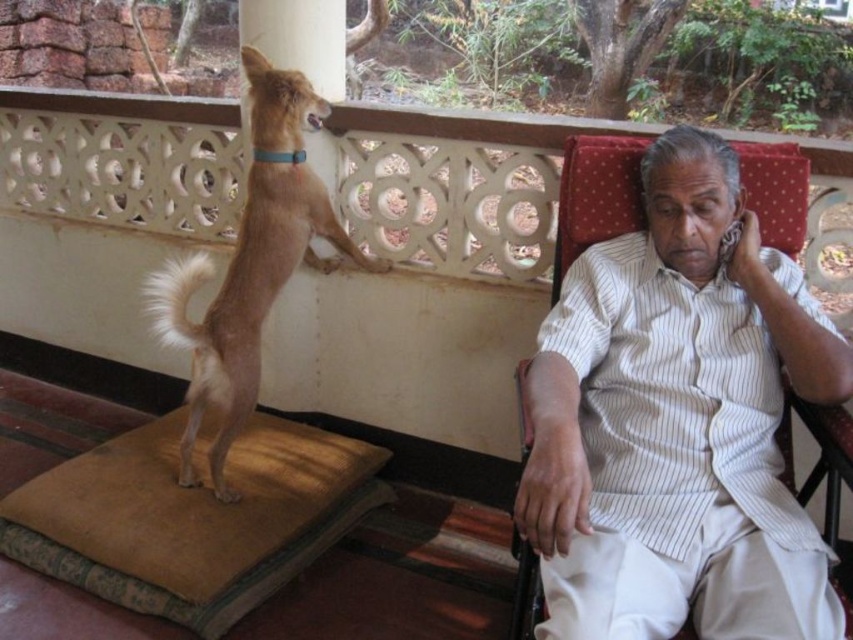
You are a fashion designer observing the scene. You need to determine which object is smaller in size between the white striped shirt at right and the light brown fur dog at left. Which one is it?

The white striped shirt at right has a smaller size compared to the light brown fur dog at left, so the white striped shirt at right is smaller.

You are a photographer trying to capture a candid shot of the man and his dog. You need to position yourself so that both subjects are in the frame. Based on their positions, which side of the scene should you stand to ensure both the white striped shirt at right and the light brown fur dog at left are visible in your shot?

You should position yourself to the left side of the scene so that both the white striped shirt at right and the light brown fur dog at left are visible in the frame. Since the white striped shirt at right is to the right of the light brown fur dog at left, standing to the left allows you to capture both subjects within the frame.